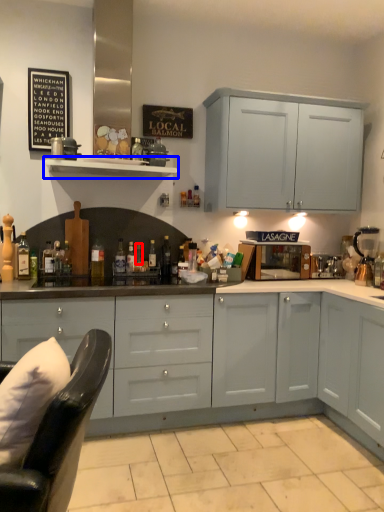
Question: Which object appears farthest to the camera in this image, bottle (highlighted by a red box) or shelf (highlighted by a blue box)?

Choices:
 (A) bottle
 (B) shelf

Answer: (A)